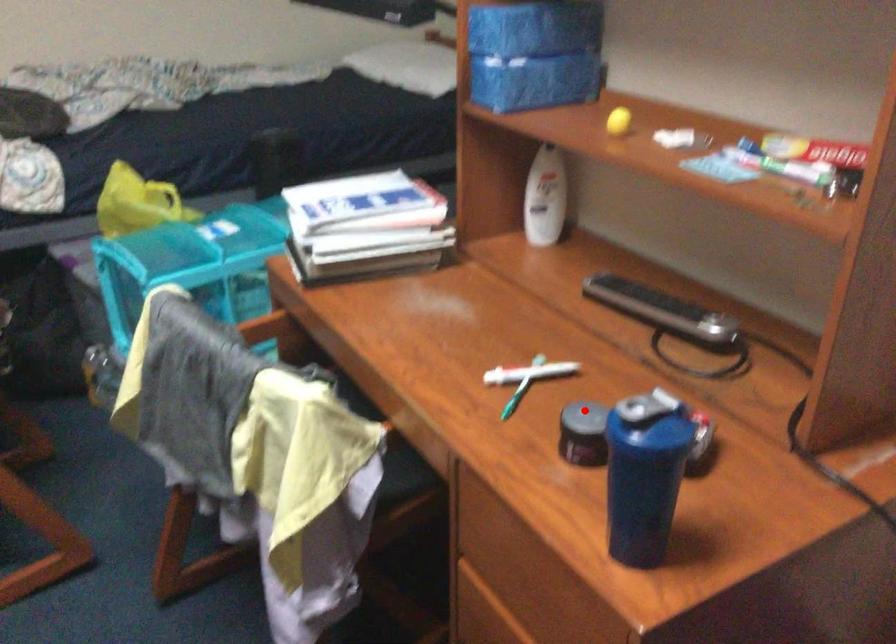
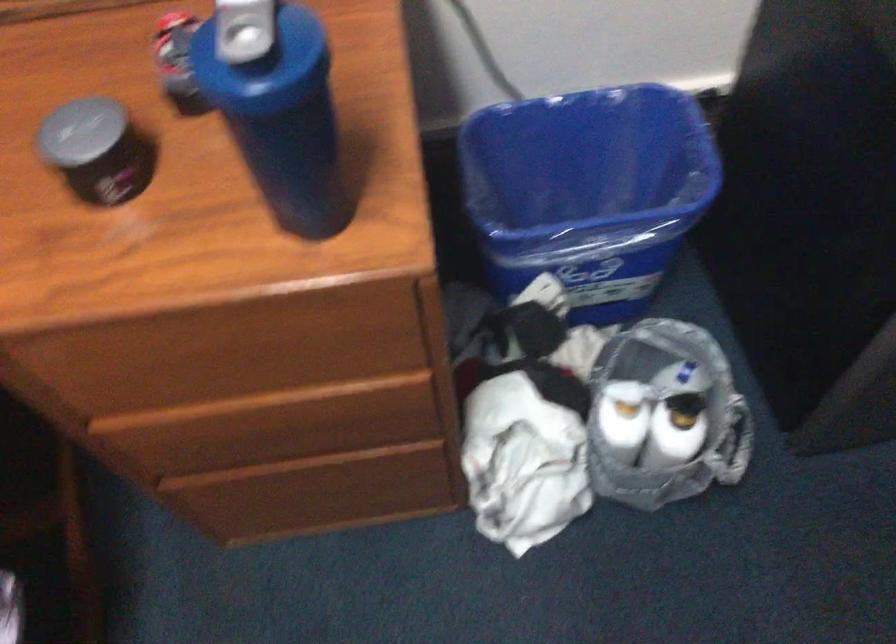
Where in the second image is the point corresponding to the highlighted location from the first image?

(80, 131)